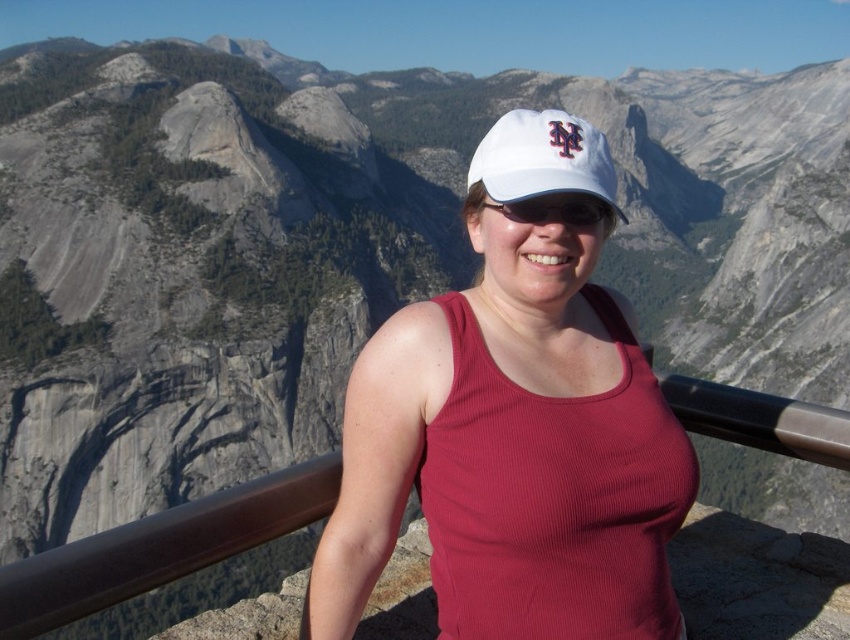
Is white matte baseball cap at center to the right of white matte cap at center from the viewer's perspective?

In fact, white matte baseball cap at center is to the left of white matte cap at center.

The height and width of the screenshot is (640, 850). Describe the element at coordinates (514, 426) in the screenshot. I see `white matte baseball cap at center` at that location.

Where is `white matte baseball cap at center`? This screenshot has height=640, width=850. white matte baseball cap at center is located at coordinates (514, 426).

Does point (556, 131) come in front of point (542, 220)?

Yes.

Is point (523, 156) positioned after point (542, 196)?

That is False.

Find the location of a particular element. This screenshot has height=640, width=850. white fabric cap at center is located at coordinates (544, 157).

Where is `white fabric cap at center`? The image size is (850, 640). white fabric cap at center is located at coordinates click(544, 157).

Is white matte baseball cap at center above white fabric cap at center?

Incorrect, white matte baseball cap at center is not positioned above white fabric cap at center.

Can you confirm if white matte baseball cap at center is taller than white fabric cap at center?

Correct, white matte baseball cap at center is much taller as white fabric cap at center.

The image size is (850, 640). Describe the element at coordinates (514, 426) in the screenshot. I see `white matte baseball cap at center` at that location.

Find the location of a particular element. The height and width of the screenshot is (640, 850). white matte baseball cap at center is located at coordinates [514, 426].